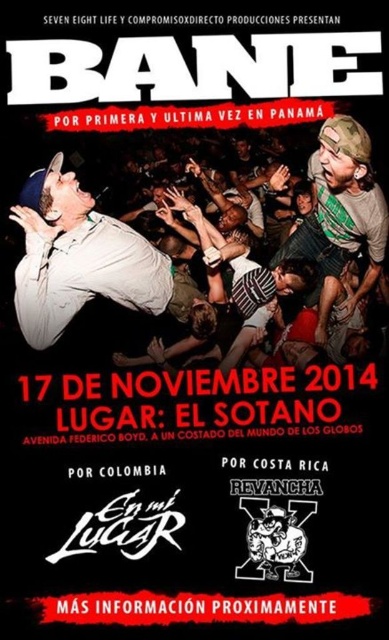
Is matte white shirt at upper left thinner than white matte shirt at center?

In fact, matte white shirt at upper left might be wider than white matte shirt at center.

Which of these two, matte white shirt at upper left or white matte shirt at center, stands shorter?

With less height is white matte shirt at center.

Is point (70, 298) positioned before point (36, 173)?

That is False.

Where is `matte white shirt at upper left`? matte white shirt at upper left is located at coordinates (77, 259).